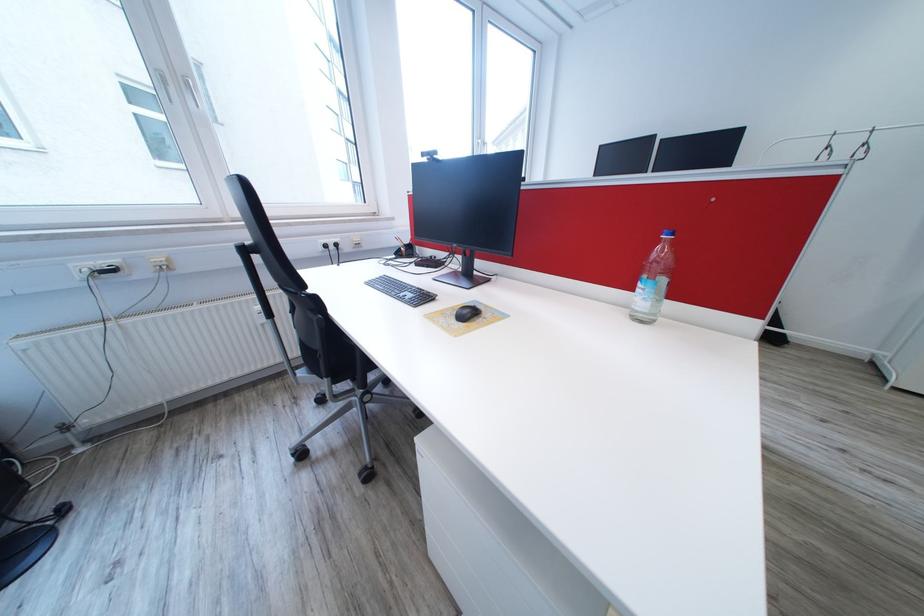
What do you see at coordinates (666, 238) in the screenshot? I see `the blue bottle cap` at bounding box center [666, 238].